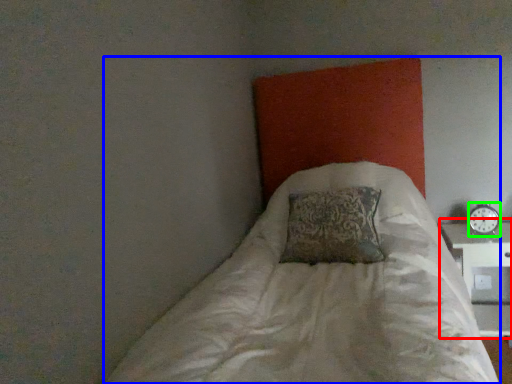
Question: Which object is the farthest from table (highlighted by a red box)? Choose among these: bed (highlighted by a blue box) or clock (highlighted by a green box).

Choices:
 (A) bed
 (B) clock

Answer: (A)